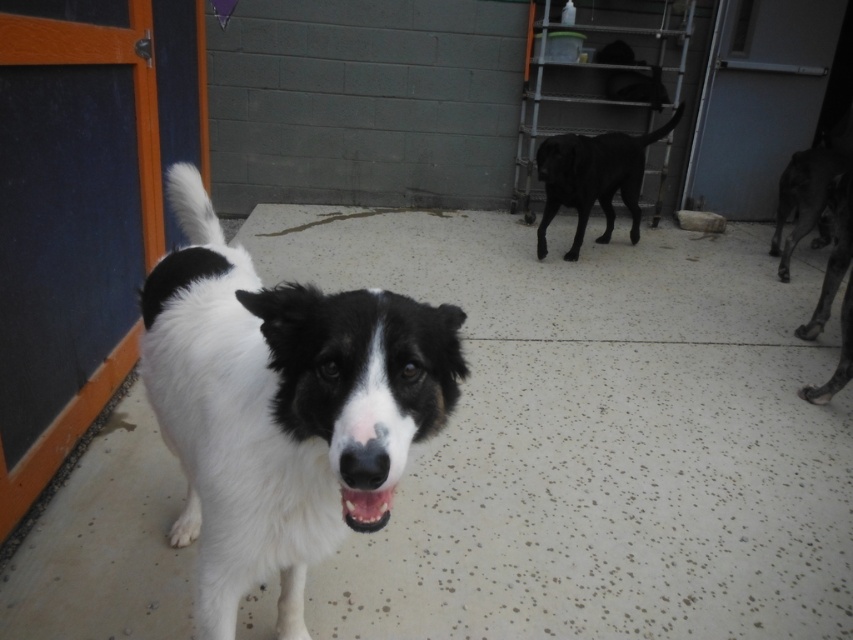
Question: Can you confirm if black smooth dog at center is wider than white glossy teeth at center?

Choices:
 (A) no
 (B) yes

Answer: (B)

Question: Which is farther from the black smooth dog at right?

Choices:
 (A) white fur dog at center
 (B) white glossy teeth at center

Answer: (B)

Question: Which point is closer to the camera?

Choices:
 (A) white glossy teeth at center
 (B) black smooth dog at center
 (C) white fur dog at center

Answer: (C)

Question: Is white fur dog at center thinner than black smooth dog at right?

Choices:
 (A) no
 (B) yes

Answer: (B)

Question: Is black smooth dog at center smaller than black smooth dog at right?

Choices:
 (A) no
 (B) yes

Answer: (B)

Question: Among these objects, which one is farthest from the camera?

Choices:
 (A) white glossy teeth at center
 (B) black smooth dog at center
 (C) black smooth dog at right
 (D) white fur dog at center

Answer: (B)